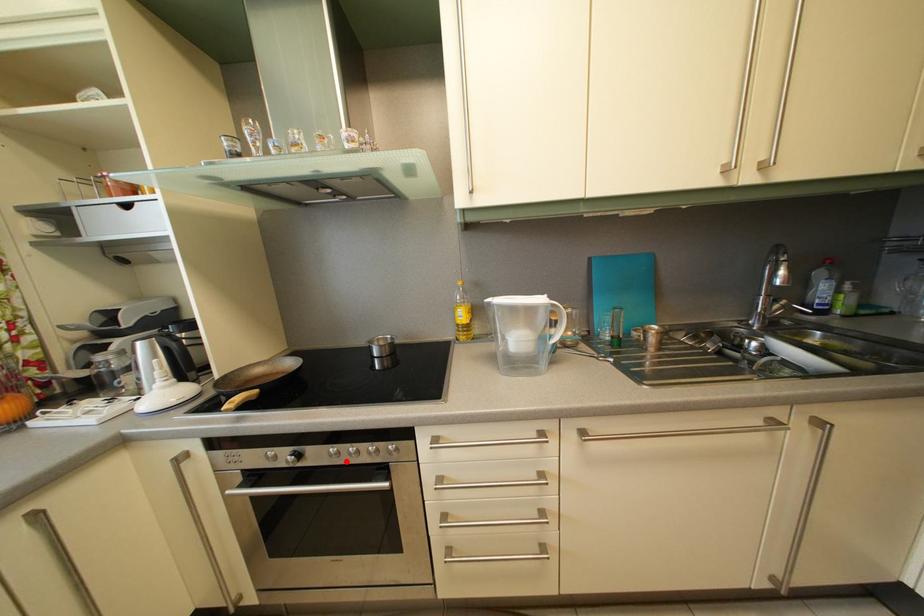
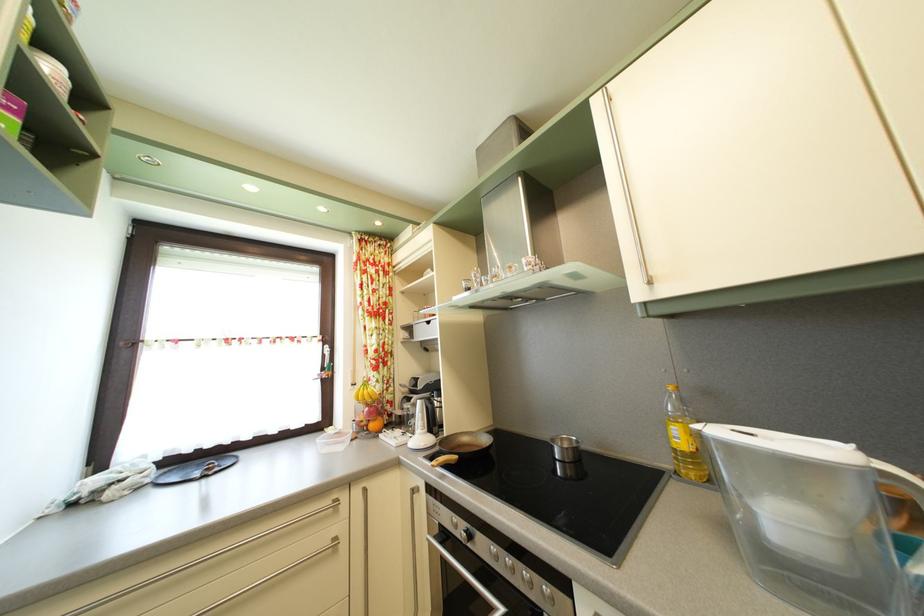
Find the pixel in the second image that matches the highlighted location in the first image.

(505, 565)